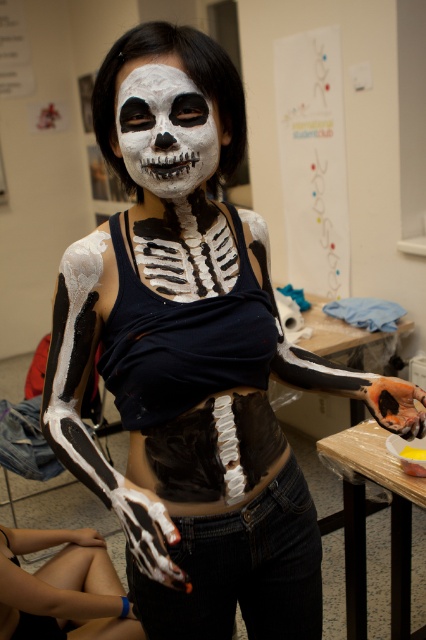
Question: Which of the following is the closest to the observer?

Choices:
 (A) white matte skeleton hand at lower left
 (B) white matte skull at center

Answer: (B)

Question: Is white matte skeleton hand at lower left above white matte skull at center?

Choices:
 (A) no
 (B) yes

Answer: (A)

Question: Can you confirm if white matte skeleton hand at lower left is bigger than white matte skull at center?

Choices:
 (A) no
 (B) yes

Answer: (B)

Question: Does white matte skeleton hand at lower left appear over white matte skull at center?

Choices:
 (A) no
 (B) yes

Answer: (A)